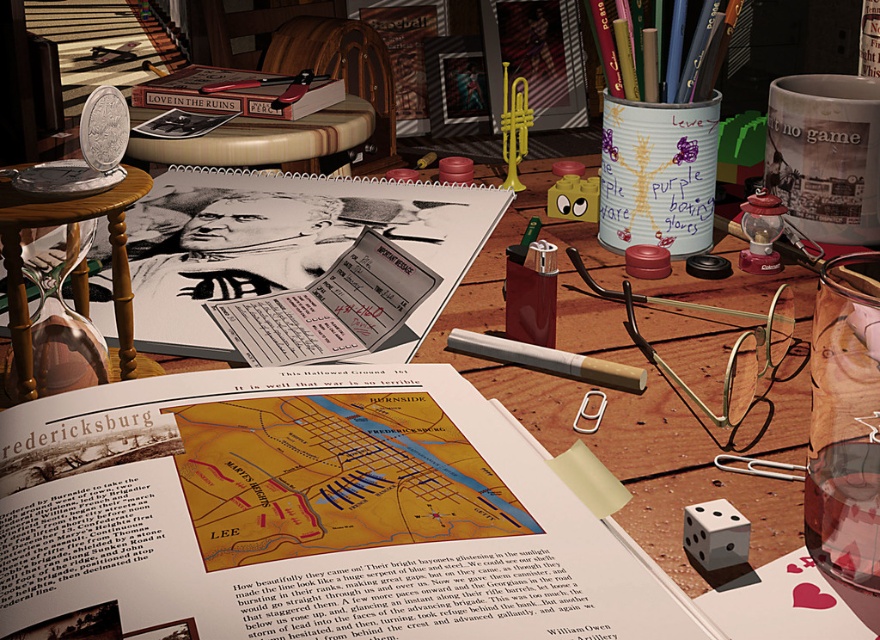
Is shiny burgundy lighter at center above pink glass lamp at center right?

Actually, shiny burgundy lighter at center is below pink glass lamp at center right.

Who is more distant from viewer, (507, 275) or (742, 224)?

Positioned behind is point (742, 224).

The image size is (880, 640). Identify the location of shiny burgundy lighter at center. (530, 292).

Can you confirm if wooden table at lower left is wider than matte black book at upper left?

In fact, wooden table at lower left might be narrower than matte black book at upper left.

Which is more to the left, wooden table at lower left or matte black book at upper left?

matte black book at upper left is more to the left.

Which is in front, point (123, 248) or point (134, 125)?

Point (123, 248) is more forward.

In order to click on wooden table at lower left in this screenshot , I will do `click(68, 224)`.

Which of these two, shiny burgundy lighter at center or matte black book at upper left, stands shorter?

matte black book at upper left is shorter.

Is point (521, 285) farther from viewer compared to point (236, 115)?

No.

Image resolution: width=880 pixels, height=640 pixels. Find the location of `shiny burgundy lighter at center`. shiny burgundy lighter at center is located at coordinates (530, 292).